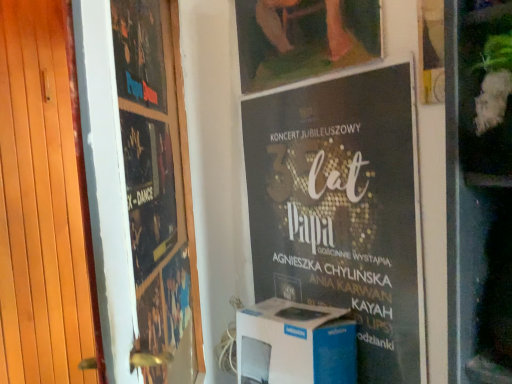
Question: Relative to wooden at left, is black paper poster at center, placed as the third poster when sorted from left to right, in front or behind?

Choices:
 (A) behind
 (B) front

Answer: (A)

Question: From a real-world perspective, is black paper poster at center, which appears as the 1th poster when viewed from the right, positioned above or below wooden at left?

Choices:
 (A) below
 (B) above

Answer: (A)

Question: Which object is the closest to the matte black poster at left, which is the second poster from right to left?

Choices:
 (A) matte wooden picture frame at upper center
 (B) white cardboard box at center
 (C) matte black poster at upper left, the third poster positioned from the right
 (D) black paper poster at center, placed as the third poster when sorted from left to right
 (E) wooden at left

Answer: (C)

Question: Which object is positioned farthest from the wooden at left?

Choices:
 (A) matte black poster at left, which is the second poster from right to left
 (B) white cardboard box at center
 (C) matte black poster at upper left, placed as the first poster when sorted from left to right
 (D) black paper poster at center, placed as the third poster when sorted from left to right
 (E) matte wooden picture frame at upper center

Answer: (D)